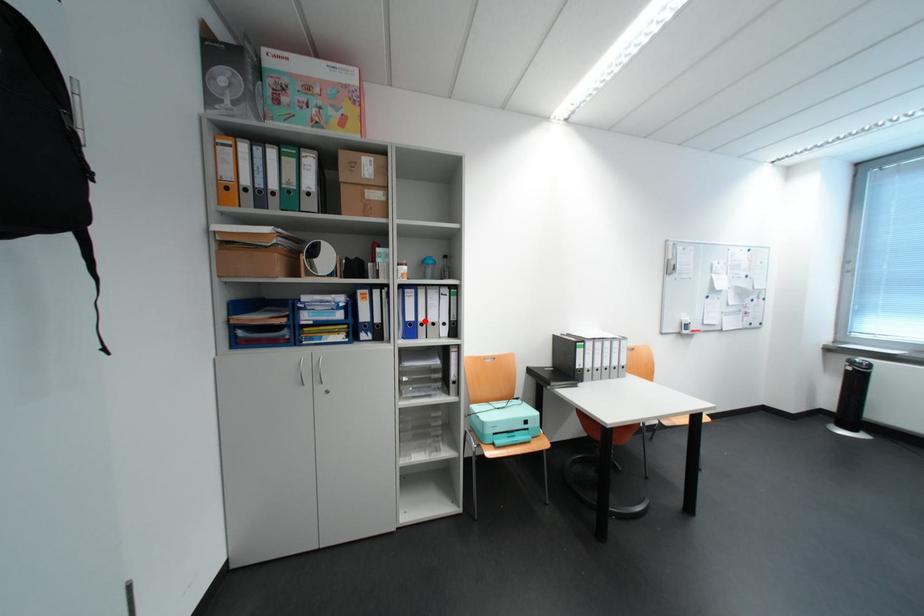
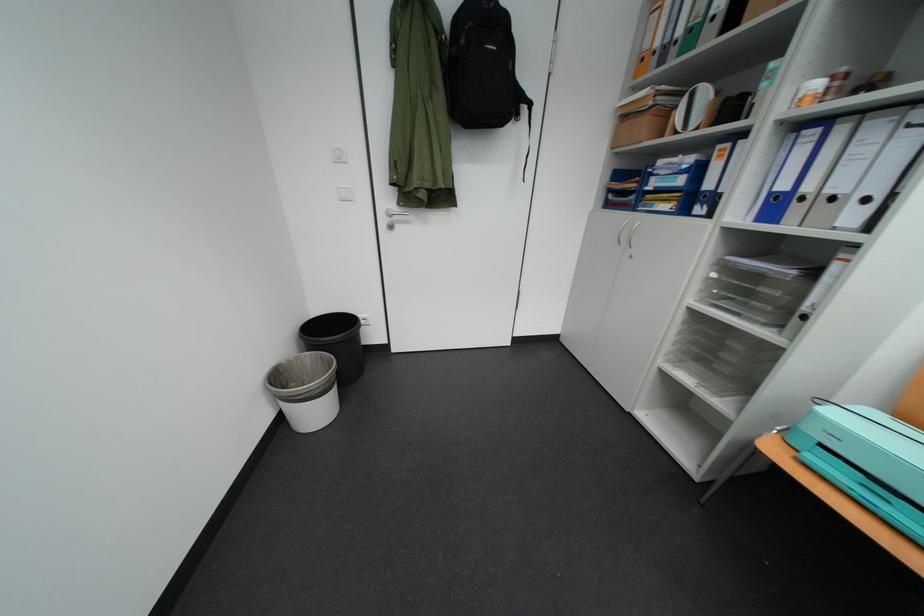
Find the pixel in the second image that matches the highlighted location in the first image.

(799, 190)